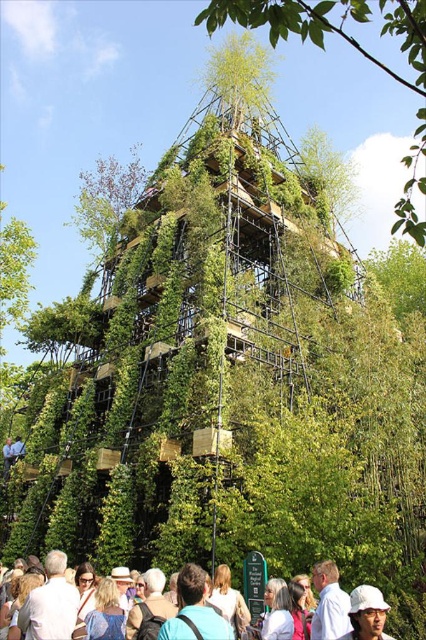
You are standing in front of the pyramid building covered in greenery. You notice a white cotton shirt at lower center and a white matte hat at center. Which object is taller?

The white cotton shirt at lower center is taller than the white matte hat at center.

Please provide the exact 2D coordinates of the green leafy structure at center in the image.

The green leafy structure at center is located at coordinates point (356, 49).